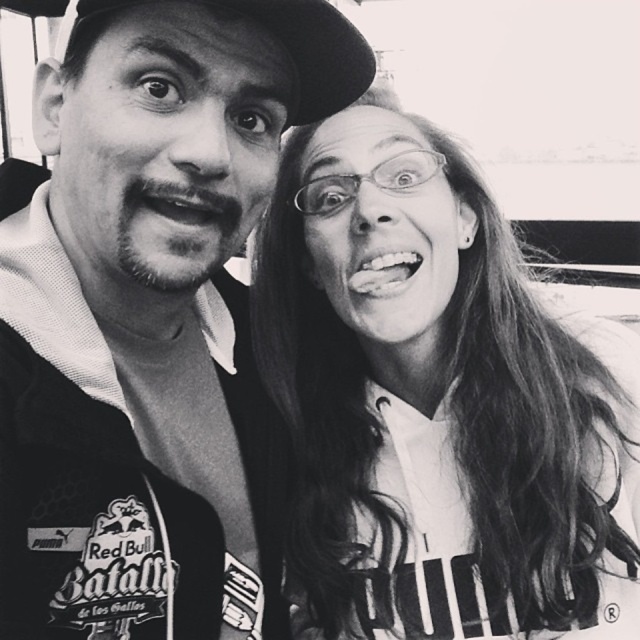
Question: Which object appears farthest from the camera in this image?

Choices:
 (A) black fabric baseball hat at upper center
 (B) smooth leather jacket at center

Answer: (A)

Question: Does smooth leather jacket at center appear on the left side of smooth white shirt at upper right?

Choices:
 (A) yes
 (B) no

Answer: (A)

Question: Which point is farther from the camera taking this photo?

Choices:
 (A) (310, 516)
 (B) (337, 76)
 (C) (262, 1)

Answer: (A)

Question: Is smooth leather jacket at center above smooth white shirt at upper right?

Choices:
 (A) yes
 (B) no

Answer: (A)

Question: Which object is farther from the camera taking this photo?

Choices:
 (A) smooth leather jacket at center
 (B) smooth white shirt at upper right
 (C) black fabric baseball hat at upper center

Answer: (B)

Question: Does smooth leather jacket at center appear on the left side of black fabric baseball hat at upper center?

Choices:
 (A) yes
 (B) no

Answer: (A)